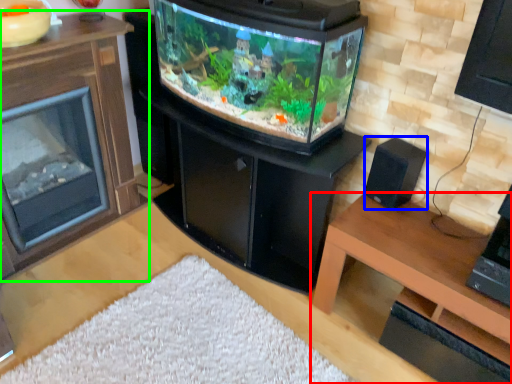
Question: Which is farther away from table (highlighted by a red box)? speaker (highlighted by a blue box) or furniture (highlighted by a green box)?

Choices:
 (A) speaker
 (B) furniture

Answer: (B)